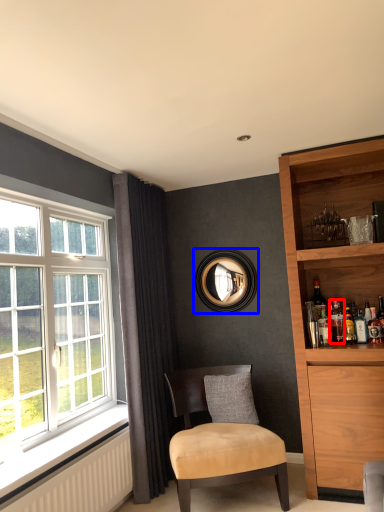
Question: Which of the following is the closest to the observer, beverage (highlighted by a red box) or picture frame (highlighted by a blue box)?

Choices:
 (A) beverage
 (B) picture frame

Answer: (A)